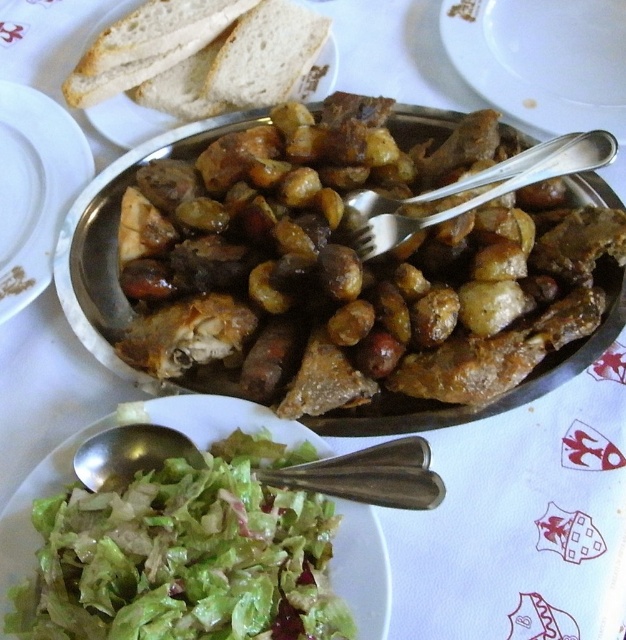
Find the location of `white glossy plate at upper center`. white glossy plate at upper center is located at coordinates (541, 58).

Between white glossy plate at upper center and satin silver fork at upper center, which one has more height?

With more height is white glossy plate at upper center.

Is point (583, 61) positioned behind point (511, 168)?

Yes.

Locate an element on the screen. white glossy plate at upper center is located at coordinates (541, 58).

Who is lower down, white glossy plate at upper center or silvermetallicspoon at lower left?

silvermetallicspoon at lower left is below.

Locate an element on the screen. white glossy plate at upper center is located at coordinates (541, 58).

The height and width of the screenshot is (640, 626). What are the coordinates of `white glossy plate at upper center` in the screenshot? It's located at (541, 58).

Can you confirm if brown matte platter at center is positioned below satin silver fork at upper center?

No.

You are a GUI agent. You are given a task and a screenshot of the screen. Output one action in this format:
    pyautogui.click(x=<x>, y=<y>)
    Task: Click on the brown matte platter at center
    This screenshot has height=640, width=626.
    Given the screenshot: What is the action you would take?
    pyautogui.click(x=34, y=188)